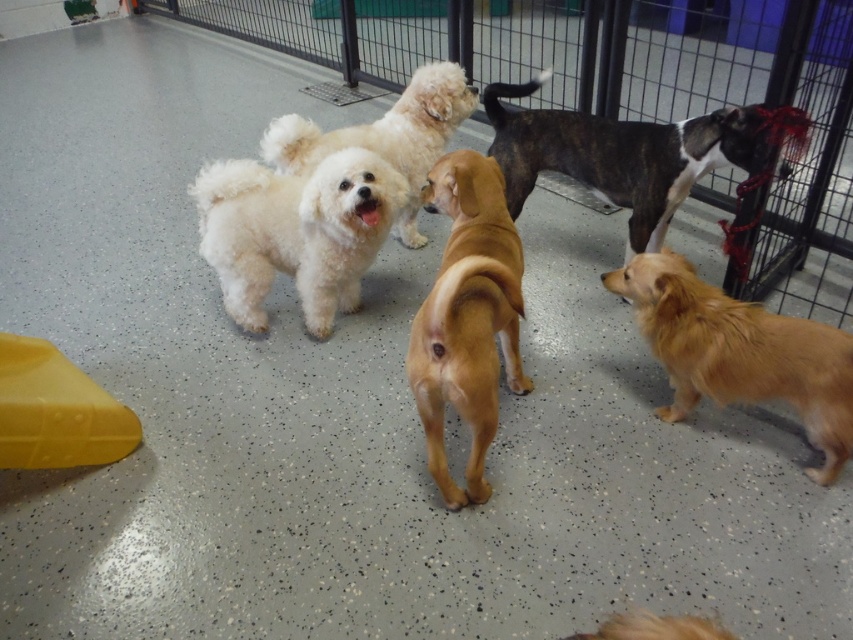
Is metallic wire cage at center bigger than brindle fur dog at center?

Correct, metallic wire cage at center is larger in size than brindle fur dog at center.

Is metallic wire cage at center thinner than brindle fur dog at center?

No.

Between point (515, 20) and point (672, 193), which one is positioned behind?

The point (515, 20) is behind.

Identify the location of metallic wire cage at center. This screenshot has height=640, width=853. (624, 88).

Who is positioned more to the left, metallic wire cage at center or fluffy white dog at center?

From the viewer's perspective, fluffy white dog at center appears more on the left side.

Where is `metallic wire cage at center`? The width and height of the screenshot is (853, 640). metallic wire cage at center is located at coordinates (624, 88).

The width and height of the screenshot is (853, 640). I want to click on metallic wire cage at center, so click(624, 88).

Is point (186, 13) more distant than point (670, 260)?

Yes, point (186, 13) is farther from viewer.

Where is `metallic wire cage at center`? Image resolution: width=853 pixels, height=640 pixels. metallic wire cage at center is located at coordinates (624, 88).

Identify the location of metallic wire cage at center. (624, 88).